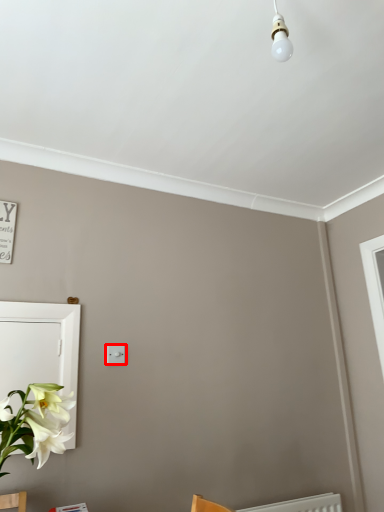
Question: Considering the relative positions of light switch (annotated by the red box) and medicine cabinet in the image provided, where is light switch (annotated by the red box) located with respect to the staircase?

Choices:
 (A) left
 (B) right

Answer: (B)